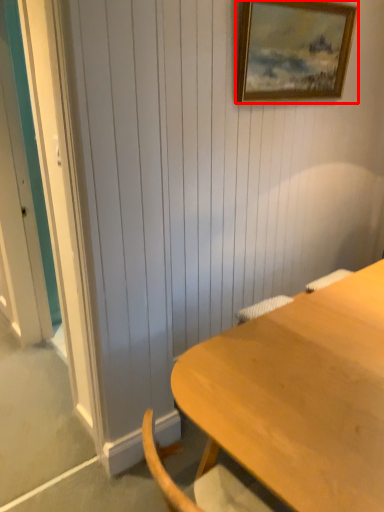
Question: From the image's perspective, what is the correct spatial positioning of picture frame (annotated by the red box) in reference to desk?

Choices:
 (A) below
 (B) above

Answer: (B)